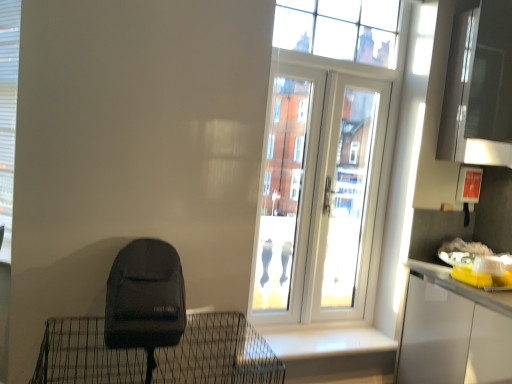
What do you see at coordinates (319, 196) in the screenshot?
I see `white glossy door at upper center` at bounding box center [319, 196].

Measure the distance between point (378, 44) and camera.

Point (378, 44) is 2.68 meters away from camera.

Find the location of a particular element. The image size is (512, 384). white glossy window sill at lower center is located at coordinates (324, 341).

Locate an element on the screen. The width and height of the screenshot is (512, 384). white glossy door at upper center is located at coordinates (319, 196).

Looking at this image, from the image's perspective, which object appears higher, white glossy window sill at lower center or black matte backpack at lower left?

black matte backpack at lower left.

The image size is (512, 384). Identify the location of furniture above the white glossy window sill at lower center (from a real-world perspective). (218, 353).

Is white glossy window sill at lower center far from black matte backpack at lower left?

No, white glossy window sill at lower center is not far away from black matte backpack at lower left.

Can you see clear glass window at upper center touching white glossy window sill at lower center?

No, clear glass window at upper center is not with white glossy window sill at lower center.

Is clear glass window at upper center taller than white glossy window sill at lower center?

Yes, clear glass window at upper center is taller than white glossy window sill at lower center.

What are the coordinates of `window sill that is on the left side of clear glass window at upper center` in the screenshot? It's located at (324, 341).

Considering the relative sizes of clear glass window at upper center and white glossy window sill at lower center in the image provided, is clear glass window at upper center bigger than white glossy window sill at lower center?

Yes, clear glass window at upper center is bigger than white glossy window sill at lower center.

Which of these two, white plastic shutter at left or black matte backpack at lower left, stands shorter?

black matte backpack at lower left.

Considering the positions of objects white plastic shutter at left and black matte backpack at lower left in the image provided, who is behind, white plastic shutter at left or black matte backpack at lower left?

Positioned behind is white plastic shutter at left.

From the picture: Is white plastic shutter at left positioned with its back to black matte backpack at lower left?

white plastic shutter at left does not have its back to black matte backpack at lower left.

In terms of size, does white plastic shutter at left appear bigger or smaller than black matte backpack at lower left?

In the image, white plastic shutter at left appears to be smaller than black matte backpack at lower left.

In the scene shown: Is black matte backpack at lower left smaller than white glossy door at upper center?

Incorrect, black matte backpack at lower left is not smaller in size than white glossy door at upper center.

Locate an element on the screen. This screenshot has width=512, height=384. door that is above the black matte backpack at lower left (from the image's perspective) is located at coordinates (319, 196).

Is black matte backpack at lower left taller than white glossy door at upper center?

Incorrect, the height of black matte backpack at lower left is not larger of that of white glossy door at upper center.

From the image's perspective, is black matte backpack at lower left on top of white glossy door at upper center?

Incorrect, from the image's perspective, black matte backpack at lower left is lower than white glossy door at upper center.

In terms of width, does black matte backpack at lower left look wider or thinner when compared to clear glass window at upper center?

black matte backpack at lower left is wider than clear glass window at upper center.

Which of these two, black matte backpack at lower left or clear glass window at upper center, stands shorter?

With less height is black matte backpack at lower left.

Considering the relative sizes of black matte backpack at lower left and clear glass window at upper center in the image provided, is black matte backpack at lower left smaller than clear glass window at upper center?

Incorrect, black matte backpack at lower left is not smaller in size than clear glass window at upper center.

Is black matte backpack at lower left touching clear glass window at upper center?

No, black matte backpack at lower left is not next to clear glass window at upper center.

Locate an element on the screen. The width and height of the screenshot is (512, 384). window sill that appears in front of the white glossy door at upper center is located at coordinates (324, 341).

From a real-world perspective, which object rests below the other?

white glossy window sill at lower center, from a real-world perspective.

Who is smaller, white glossy door at upper center or white glossy window sill at lower center?

Smaller between the two is white glossy window sill at lower center.

Is white glossy door at upper center completely or partially outside of white glossy window sill at lower center?

Indeed, white glossy door at upper center is completely outside white glossy window sill at lower center.

Is black matte backpack at lower left not near white plastic shutter at left?

black matte backpack at lower left is actually quite close to white plastic shutter at left.

Is black matte backpack at lower left oriented towards white plastic shutter at left?

No, black matte backpack at lower left is not facing towards white plastic shutter at left.

Is black matte backpack at lower left to the right of white plastic shutter at left from the viewer's perspective?

Correct, you'll find black matte backpack at lower left to the right of white plastic shutter at left.

Identify the location of furniture on the left of the white glossy window sill at lower center. (218, 353).

Find the location of a particular element. window lying behind the white glossy window sill at lower center is located at coordinates (340, 29).

From the image, which object appears to be nearer to clear glass window at upper center, white glossy window sill at lower center or white glossy door at upper center?

white glossy door at upper center lies closer to clear glass window at upper center than the other object.

Based on their spatial positions, is white glossy window sill at lower center or black matte backpack at lower left closer to clear glass window at upper center?

white glossy window sill at lower center is closer to clear glass window at upper center.

Based on their spatial positions, is white plastic shutter at left or clear glass window at upper center further from white glossy window sill at lower center?

clear glass window at upper center lies further to white glossy window sill at lower center than the other object.

Considering their positions, is clear glass window at upper center positioned further to white glossy window sill at lower center than black matte backpack at lower left?

The object further to white glossy window sill at lower center is clear glass window at upper center.

Consider the image. When comparing their distances from white glossy door at upper center, does white plastic shutter at left or black matte backpack at lower left seem further?

Among the two, white plastic shutter at left is located further to white glossy door at upper center.

Which object lies nearer to the anchor point white glossy window sill at lower center, white glossy door at upper center or black matte backpack at lower left?

black matte backpack at lower left.

From the image, which object appears to be nearer to white plastic shutter at left, clear glass window at upper center or white glossy window sill at lower center?

Based on the image, clear glass window at upper center appears to be nearer to white plastic shutter at left.

When comparing their distances from clear glass window at upper center, does black matte backpack at lower left or white glossy door at upper center seem further?

Based on the image, black matte backpack at lower left appears to be further to clear glass window at upper center.

Find the location of `furniture between white glossy door at upper center and white glossy window sill at lower center in the vertical direction`. furniture between white glossy door at upper center and white glossy window sill at lower center in the vertical direction is located at coordinates (218, 353).

Image resolution: width=512 pixels, height=384 pixels. Find the location of `window sill between white plastic shutter at left and clear glass window at upper center in the horizontal direction`. window sill between white plastic shutter at left and clear glass window at upper center in the horizontal direction is located at coordinates (324, 341).

I want to click on furniture between clear glass window at upper center and white glossy window sill at lower center in the up-down direction, so click(x=218, y=353).

Identify the location of door located between white plastic shutter at left and clear glass window at upper center in the left-right direction. pos(319,196).